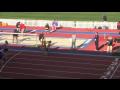
Where is `wall`? wall is located at coordinates (83, 25).